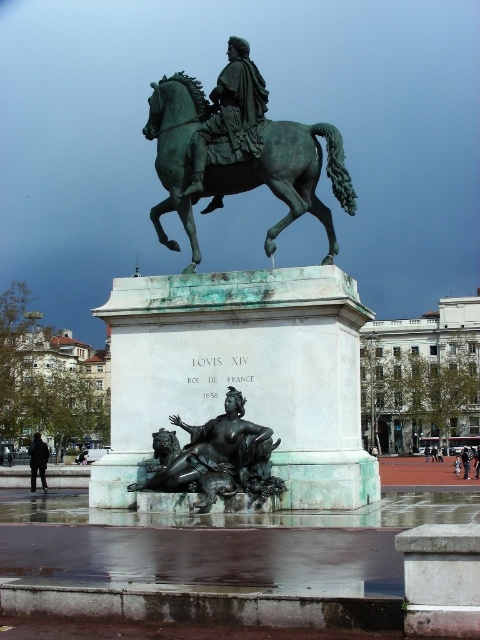
Question: Can you confirm if green patina bronze horse at center is positioned above brushed metal person at lower right?

Choices:
 (A) no
 (B) yes

Answer: (B)

Question: Which point is farther to the camera?

Choices:
 (A) black matte jacket at lower left
 (B) green patina statue at center
 (C) bronze statue at lower center

Answer: (A)

Question: Which is farther from the bronze statue at lower center?

Choices:
 (A) green patina bronze horse at center
 (B) green patina horse at center
 (C) black matte jacket at lower left

Answer: (C)

Question: Is bronze statue at lower center further to the viewer compared to black matte jacket at lower left?

Choices:
 (A) no
 (B) yes

Answer: (A)

Question: Is green patina statue at center above black matte jacket at lower left?

Choices:
 (A) no
 (B) yes

Answer: (B)

Question: Based on their relative distances, which object is nearer to the green patina horse at center?

Choices:
 (A) green patina statue at center
 (B) brushed metal person at lower right

Answer: (A)